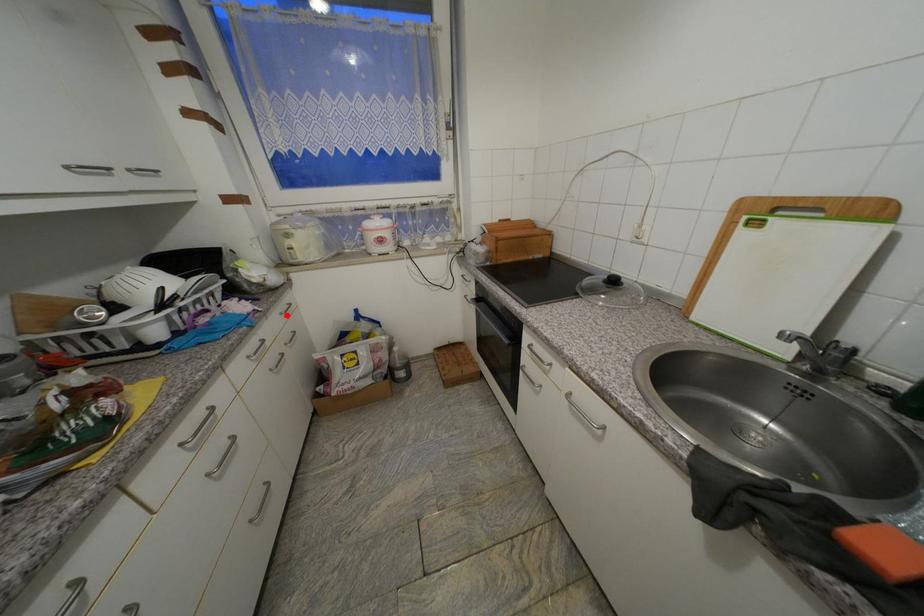
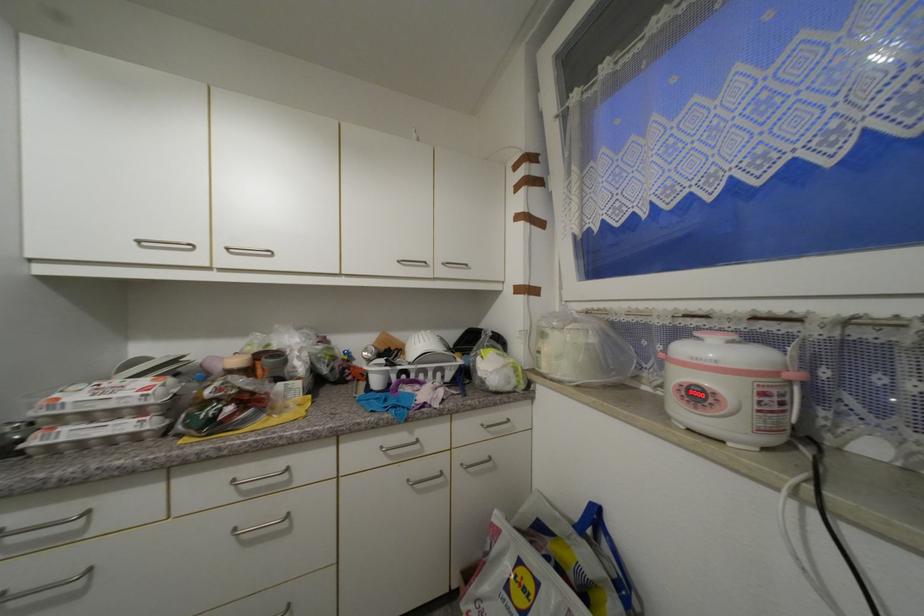
Question: I am providing you with two images of the same scene from different viewpoints. Image1 has a red point marked. In image2, the corresponding 3D location appears at what relative position? Reply with the corresponding letter.

Choices:
 (A) Closer
 (B) Farther

Answer: (B)